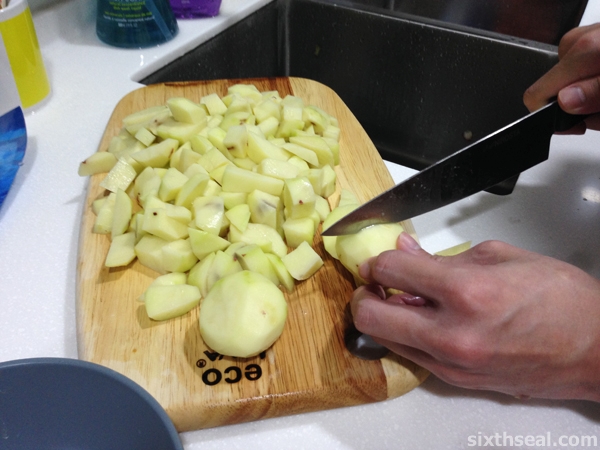
Identify the location of yellow cup. Image resolution: width=600 pixels, height=450 pixels. (26, 57).